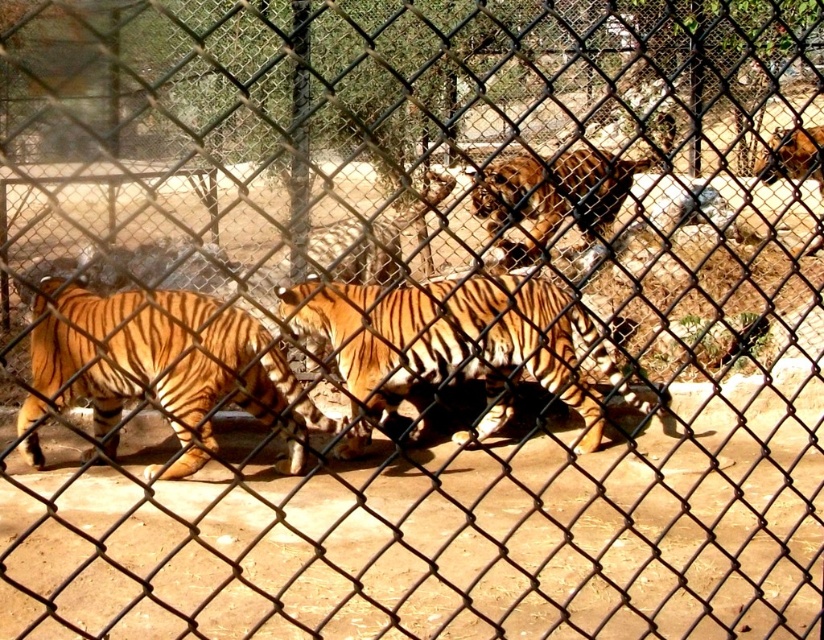
You are a zookeeper planning to feed the tigers. You see the orange striped tiger at center and the orange striped tiger at left. Which tiger is closer to the fence that you are standing near?

The orange striped tiger at center is closer to the fence because the orange striped tiger at left is behind it, meaning the tiger at center is in front and nearer to the fence.